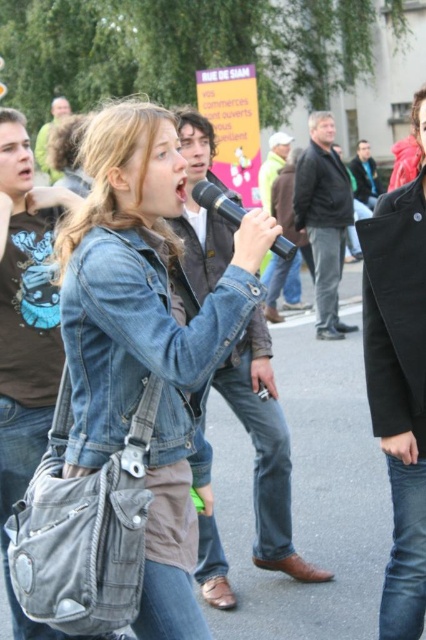
Question: From the image, what is the correct spatial relationship of brushed metal shirt at center in relation to brown leather jacket at upper left?

Choices:
 (A) left
 (B) right

Answer: (B)

Question: Which of the following is the farthest from the observer?

Choices:
 (A) (247, 410)
 (B) (362, 157)

Answer: (B)

Question: Which point is farther to the camera?

Choices:
 (A) (45, 172)
 (B) (265, 406)
 (C) (31, 340)

Answer: (A)

Question: Can you confirm if brushed metal shirt at center is bigger than black matte microphone at center?

Choices:
 (A) no
 (B) yes

Answer: (B)

Question: Which point appears closest to the camera in this image?

Choices:
 (A) (371, 310)
 (B) (172, 404)
 (C) (23, 291)

Answer: (B)

Question: Is brushed metal shirt at center above dark gray leather jacket at center?

Choices:
 (A) yes
 (B) no

Answer: (B)